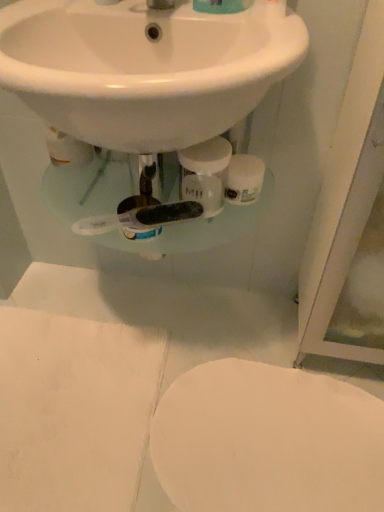
Question: Does white glossy toilet at lower right appear on the right side of white glossy sink at upper center?

Choices:
 (A) no
 (B) yes

Answer: (B)

Question: From the image's perspective, is white glossy toilet at lower right beneath white glossy sink at upper center?

Choices:
 (A) no
 (B) yes

Answer: (B)

Question: Can you confirm if white glossy toilet at lower right is shorter than white glossy sink at upper center?

Choices:
 (A) no
 (B) yes

Answer: (B)

Question: Considering the relative sizes of white glossy toilet at lower right and white glossy sink at upper center in the image provided, is white glossy toilet at lower right thinner than white glossy sink at upper center?

Choices:
 (A) yes
 (B) no

Answer: (A)

Question: Is white glossy toilet at lower right aimed at white glossy sink at upper center?

Choices:
 (A) no
 (B) yes

Answer: (A)

Question: Looking at their shapes, would you say white glossy toilet at lower right is wider or thinner than white matte toilet paper at center?

Choices:
 (A) thin
 (B) wide

Answer: (B)

Question: Is white glossy toilet at lower right situated inside white matte toilet paper at center or outside?

Choices:
 (A) outside
 (B) inside

Answer: (A)

Question: Considering the positions of white glossy toilet at lower right and white matte toilet paper at center in the image, is white glossy toilet at lower right taller or shorter than white matte toilet paper at center?

Choices:
 (A) tall
 (B) short

Answer: (B)

Question: From a real-world perspective, is white glossy toilet at lower right positioned above or below white matte toilet paper at center?

Choices:
 (A) above
 (B) below

Answer: (B)

Question: From a real-world perspective, is white matte toilet paper at center above or below white glossy toilet at lower right?

Choices:
 (A) above
 (B) below

Answer: (A)

Question: In terms of width, does white matte toilet paper at center look wider or thinner when compared to white glossy toilet at lower right?

Choices:
 (A) wide
 (B) thin

Answer: (B)

Question: From their relative heights in the image, would you say white matte toilet paper at center is taller or shorter than white glossy toilet at lower right?

Choices:
 (A) short
 (B) tall

Answer: (B)

Question: Is point (240, 188) closer or farther from the camera than point (185, 474)?

Choices:
 (A) closer
 (B) farther

Answer: (A)

Question: Based on their positions, is white glossy toilet at lower right located to the left or right of white glossy sink at upper center?

Choices:
 (A) right
 (B) left

Answer: (A)

Question: Considering the positions of white glossy toilet at lower right and white glossy sink at upper center in the image, is white glossy toilet at lower right bigger or smaller than white glossy sink at upper center?

Choices:
 (A) small
 (B) big

Answer: (A)